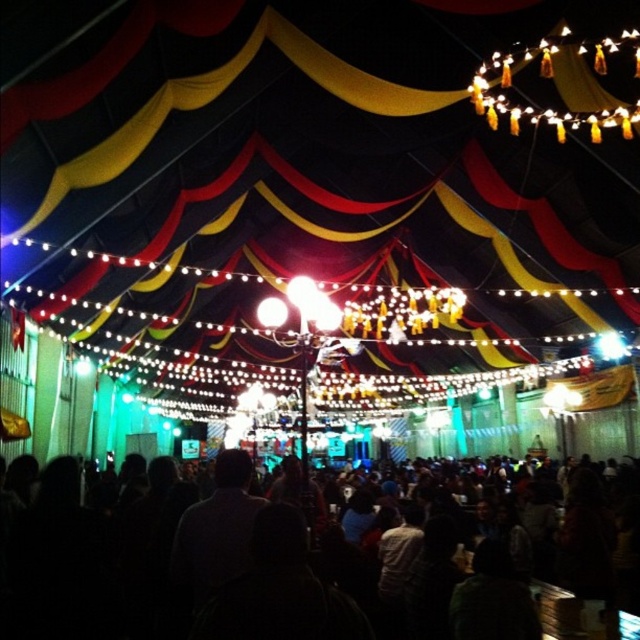
Which is above, yellow fabric canopy at upper center or black matte crowd at center?

yellow fabric canopy at upper center

Is yellow fabric canopy at upper center further to camera compared to black matte crowd at center?

Yes, yellow fabric canopy at upper center is behind black matte crowd at center.

Based on the photo, who is more distant from viewer, (246, 307) or (243, 525)?

Positioned behind is point (246, 307).

The image size is (640, 640). Identify the location of yellow fabric canopy at upper center. (310, 200).